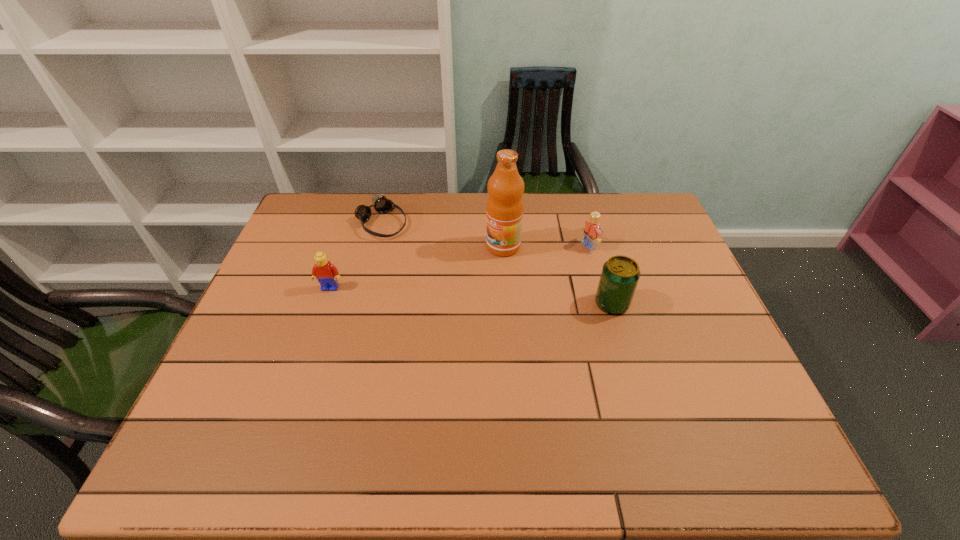
This screenshot has height=540, width=960. What are the coordinates of `the left Lego` in the screenshot? It's located at (326, 273).

The image size is (960, 540). In order to click on beer can in this screenshot , I will do `click(620, 274)`.

Find the location of a particular element. Image resolution: width=960 pixels, height=540 pixels. the farther Lego is located at coordinates coord(592,232).

I want to click on the shortest object, so [381, 204].

At what (x,y) coordinates should I click in order to perform the action: click on the third object from left to right. Please return your answer as a coordinate pair (x, y). This screenshot has height=540, width=960. Looking at the image, I should click on (504, 212).

Identify the location of fruit juice. (504, 212).

Image resolution: width=960 pixels, height=540 pixels. I want to click on vacant space located 0.210m on the front-facing side of the left Lego, so click(x=308, y=354).

The image size is (960, 540). What are the coordinates of `free space located 0.260m on the back of the beer can` in the screenshot? It's located at (591, 233).

At what (x,y) coordinates should I click in order to perform the action: click on vacant space located 0.050m on the front-facing side of the farther Lego. Please return your answer as a coordinate pair (x, y). Looking at the image, I should click on (569, 255).

The height and width of the screenshot is (540, 960). I want to click on free space located 0.140m on the front-facing side of the farther Lego, so click(545, 264).